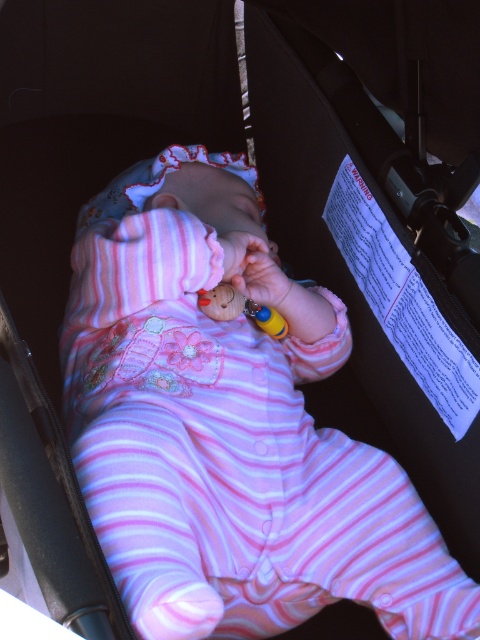
Measure the distance between pink striped fabric baby at center and rubber teething ring at center.

11.53 inches

Who is shorter, pink striped fabric baby at center or rubber teething ring at center?

rubber teething ring at center

Consider the image. Who is more forward, [148,307] or [245,301]?

Point [148,307] is more forward.

At what (x,y) coordinates should I click in order to perform the action: click on pink striped fabric baby at center. Please return your answer as a coordinate pair (x, y). The height and width of the screenshot is (640, 480). Looking at the image, I should click on (229, 428).

Consider the image. Can you confirm if wooden toy at center is wider than rubber teething ring at center?

Indeed, wooden toy at center has a greater width compared to rubber teething ring at center.

From the picture: Is wooden toy at center smaller than rubber teething ring at center?

No.

What do you see at coordinates (240, 308) in the screenshot? The width and height of the screenshot is (480, 640). I see `wooden toy at center` at bounding box center [240, 308].

Where is `wooden toy at center`? This screenshot has width=480, height=640. wooden toy at center is located at coordinates (240, 308).

Between pink striped fabric baby at center and wooden toy at center, which one is positioned lower?

Positioned lower is pink striped fabric baby at center.

Between pink striped fabric baby at center and wooden toy at center, which one is positioned higher?

Positioned higher is wooden toy at center.

Between point (254, 372) and point (226, 285), which one is positioned in front?

Point (254, 372)

At what (x,y) coordinates should I click in order to perform the action: click on pink striped fabric baby at center. Please return your answer as a coordinate pair (x, y). Looking at the image, I should click on (229, 428).